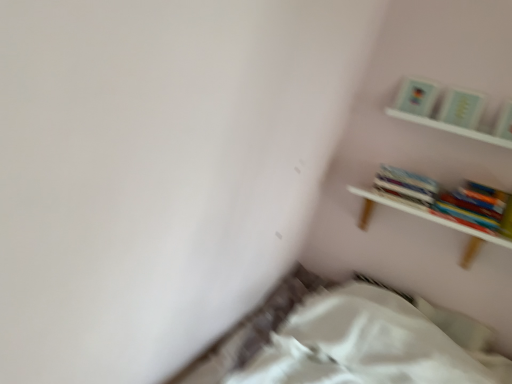
What do you see at coordinates (504, 122) in the screenshot? This screenshot has width=512, height=384. I see `hardcover book at upper right, the 1th paperback book from the right` at bounding box center [504, 122].

The width and height of the screenshot is (512, 384). I want to click on white wooden shelf at upper right, which is the first shelf from bottom to top, so click(431, 221).

The width and height of the screenshot is (512, 384). What do you see at coordinates (443, 110) in the screenshot?
I see `white wooden shelf at upper right, which is counted as the second shelf, starting from the bottom` at bounding box center [443, 110].

Locate an element on the screen. Image resolution: width=512 pixels, height=384 pixels. matte paper at upper right, the 2th paperback book when ordered from right to left is located at coordinates (461, 108).

Where is `hardcover book at upper right, the 1th paperback book from the right`? hardcover book at upper right, the 1th paperback book from the right is located at coordinates (504, 122).

Is matte paper at upper right, positioned as the 3th paperback book in right-to-left order, located within hardcover book at upper right, the 1th paperback book from the right?

Definitely not — matte paper at upper right, positioned as the 3th paperback book in right-to-left order, is not inside hardcover book at upper right, the 1th paperback book from the right.

Looking at this image, from a real-world perspective, is hardcover book at upper right, the 3th paperback book when ordered from left to right, over matte paper at upper right, positioned as the 3th paperback book in right-to-left order?

No, from a real-world perspective, hardcover book at upper right, the 3th paperback book when ordered from left to right, is not on top of matte paper at upper right, positioned as the 3th paperback book in right-to-left order.

Which of these two, hardcover book at upper right, the 1th paperback book from the right, or matte paper at upper right, acting as the first paperback book starting from the left, is wider?

With larger width is matte paper at upper right, acting as the first paperback book starting from the left.

Which is further, [499,117] or [399,102]?

The point [399,102] is behind.

From a real-world perspective, is hardcover book at upper right, the 3th paperback book when ordered from left to right, positioned under white fabric bed at lower center based on gravity?

No.

Is hardcover book at upper right, the 1th paperback book from the right, in front of white fabric bed at lower center?

No, the depth of hardcover book at upper right, the 1th paperback book from the right, is greater than that of white fabric bed at lower center.

Could you tell me if hardcover book at upper right, the 3th paperback book when ordered from left to right, is facing white fabric bed at lower center?

No, hardcover book at upper right, the 3th paperback book when ordered from left to right, is not facing towards white fabric bed at lower center.

Considering the points (502, 119) and (332, 338), which point is in front, point (502, 119) or point (332, 338)?

The point (332, 338) is in front.

How far apart are white fabric bed at lower center and matte paper at upper right, the 2th paperback book when ordered from right to left?

3.59 feet.

Is white fabric bed at lower center facing away from matte paper at upper right, which is the second paperback book from left to right?

No, white fabric bed at lower center is not facing away from matte paper at upper right, which is the second paperback book from left to right.

Considering the sizes of objects white fabric bed at lower center and matte paper at upper right, which is the second paperback book from left to right, in the image provided, who is thinner, white fabric bed at lower center or matte paper at upper right, which is the second paperback book from left to right,?

matte paper at upper right, which is the second paperback book from left to right, is thinner.

Looking at their sizes, would you say white wooden shelf at upper right, which is the first shelf from bottom to top, is wider or thinner than matte paper at upper right, positioned as the 3th paperback book in right-to-left order?

white wooden shelf at upper right, which is the first shelf from bottom to top, is wider than matte paper at upper right, positioned as the 3th paperback book in right-to-left order.

From the image's perspective, is white wooden shelf at upper right, which is the first shelf from bottom to top, above or below matte paper at upper right, positioned as the 3th paperback book in right-to-left order?

Based on their image positions, white wooden shelf at upper right, which is the first shelf from bottom to top, is located beneath matte paper at upper right, positioned as the 3th paperback book in right-to-left order.

Looking at the image, does white wooden shelf at upper right, the 2th shelf positioned from the top, seem bigger or smaller compared to matte paper at upper right, positioned as the 3th paperback book in right-to-left order?

Clearly, white wooden shelf at upper right, the 2th shelf positioned from the top, is larger in size than matte paper at upper right, positioned as the 3th paperback book in right-to-left order.

Would you say white wooden shelf at upper right, the 2th shelf positioned from the top, is to the left or to the right of matte paper at upper right, positioned as the 3th paperback book in right-to-left order, in the picture?

white wooden shelf at upper right, the 2th shelf positioned from the top, is positioned on matte paper at upper right, positioned as the 3th paperback book in right-to-left order,'s right side.

From a real-world perspective, is matte paper at upper right, acting as the first paperback book starting from the left, positioned above or below hardcover books at upper right?

matte paper at upper right, acting as the first paperback book starting from the left, is above hardcover books at upper right.

Considering the sizes of matte paper at upper right, positioned as the 3th paperback book in right-to-left order, and hardcover books at upper right in the image, is matte paper at upper right, positioned as the 3th paperback book in right-to-left order, bigger or smaller than hardcover books at upper right?

Considering their sizes, matte paper at upper right, positioned as the 3th paperback book in right-to-left order, takes up less space than hardcover books at upper right.

Is matte paper at upper right, positioned as the 3th paperback book in right-to-left order, next to hardcover books at upper right?

No, matte paper at upper right, positioned as the 3th paperback book in right-to-left order, is not making contact with hardcover books at upper right.

Considering the positions of objects matte paper at upper right, acting as the first paperback book starting from the left, and hardcover books at upper right in the image provided, who is more to the left, matte paper at upper right, acting as the first paperback book starting from the left, or hardcover books at upper right?

Positioned to the left is hardcover books at upper right.

Considering the sizes of objects hardcover books at upper right and white wooden shelf at upper right, the 1th shelf in the top-to-bottom sequence, in the image provided, who is smaller, hardcover books at upper right or white wooden shelf at upper right, the 1th shelf in the top-to-bottom sequence,?

Smaller between the two is white wooden shelf at upper right, the 1th shelf in the top-to-bottom sequence.

Starting from the hardcover books at upper right, which shelf is the 1st one in front? Please provide its 2D coordinates.

[(443, 110)]

Is white wooden shelf at upper right, which is counted as the second shelf, starting from the bottom, located within hardcover books at upper right?

No.

From the image's perspective, does hardcover books at upper right appear lower than white wooden shelf at upper right, the 1th shelf in the top-to-bottom sequence?

Yes, from the image's perspective, hardcover books at upper right is beneath white wooden shelf at upper right, the 1th shelf in the top-to-bottom sequence.

From the image's perspective, which is below, matte paper at upper right, which is the second paperback book from left to right, or white wooden shelf at upper right, the 1th shelf in the top-to-bottom sequence?

white wooden shelf at upper right, the 1th shelf in the top-to-bottom sequence, is shown below in the image.

Which is behind, point (461, 98) or point (420, 95)?

The point (420, 95) is farther from the camera.

Which object is wider, matte paper at upper right, the 2th paperback book when ordered from right to left, or white wooden shelf at upper right, which is counted as the second shelf, starting from the bottom?

white wooden shelf at upper right, which is counted as the second shelf, starting from the bottom, is wider.

Looking at this image, is matte paper at upper right, the 2th paperback book when ordered from right to left, not near white wooden shelf at upper right, the 1th shelf in the top-to-bottom sequence?

That's not correct — matte paper at upper right, the 2th paperback book when ordered from right to left, is a little close to white wooden shelf at upper right, the 1th shelf in the top-to-bottom sequence.

From the hardcover book at upper right, the 1th paperback book from the right, count 2nd paperback books backward and point to it. Please provide its 2D coordinates.

[(416, 96)]

There is a white fabric bed at lower center. Where is `the 2nd paperback book above it (from a real-world perspective)`? This screenshot has height=384, width=512. the 2nd paperback book above it (from a real-world perspective) is located at coordinates (504, 122).

Based on their spatial positions, is hardcover book at upper right, the 3th paperback book when ordered from left to right, or hardcover books at upper right closer to matte paper at upper right, which is the second paperback book from left to right?

Among the two, hardcover book at upper right, the 3th paperback book when ordered from left to right, is located nearer to matte paper at upper right, which is the second paperback book from left to right.

Considering their positions, is white fabric bed at lower center positioned further to matte paper at upper right, which is the second paperback book from left to right, than white wooden shelf at upper right, which is counted as the second shelf, starting from the bottom?

white fabric bed at lower center is positioned further to the anchor matte paper at upper right, which is the second paperback book from left to right.

Based on their spatial positions, is white wooden shelf at upper right, the 1th shelf in the top-to-bottom sequence, or hardcover book at upper right, the 1th paperback book from the right, further from matte paper at upper right, which is the second paperback book from left to right?

Among the two, hardcover book at upper right, the 1th paperback book from the right, is located further to matte paper at upper right, which is the second paperback book from left to right.

From the image, which object appears to be farther from white wooden shelf at upper right, the 2th shelf positioned from the top, matte paper at upper right, the 2th paperback book when ordered from right to left, or white fabric bed at lower center?

The object further to white wooden shelf at upper right, the 2th shelf positioned from the top, is white fabric bed at lower center.

Based on the photo, which object lies nearer to the anchor point hardcover book at upper right, the 3th paperback book when ordered from left to right, white wooden shelf at upper right, which is counted as the second shelf, starting from the bottom, or matte paper at upper right, acting as the first paperback book starting from the left?

white wooden shelf at upper right, which is counted as the second shelf, starting from the bottom, is positioned closer to the anchor hardcover book at upper right, the 3th paperback book when ordered from left to right.

Estimate the real-world distances between objects in this image. Which object is closer to hardcover book at upper right, the 3th paperback book when ordered from left to right, matte paper at upper right, acting as the first paperback book starting from the left, or white wooden shelf at upper right, which is the first shelf from bottom to top?

matte paper at upper right, acting as the first paperback book starting from the left, is closer to hardcover book at upper right, the 3th paperback book when ordered from left to right.

Which object lies nearer to the anchor point white wooden shelf at upper right, the 2th shelf positioned from the top, hardcover books at upper right or matte paper at upper right, positioned as the 3th paperback book in right-to-left order?

Among the two, hardcover books at upper right is located nearer to white wooden shelf at upper right, the 2th shelf positioned from the top.

Estimate the real-world distances between objects in this image. Which object is closer to hardcover books at upper right, white wooden shelf at upper right, the 1th shelf in the top-to-bottom sequence, or white fabric bed at lower center?

The object closer to hardcover books at upper right is white wooden shelf at upper right, the 1th shelf in the top-to-bottom sequence.

You are a GUI agent. You are given a task and a screenshot of the screen. Output one action in this format:
    pyautogui.click(x=<x>, y=<y>)
    Task: Click on the book between white fabric bed at lower center and matte paper at upper right, acting as the first paperback book starting from the left, from front to back
    Image resolution: width=512 pixels, height=384 pixels.
    Given the screenshot: What is the action you would take?
    pyautogui.click(x=406, y=184)

The width and height of the screenshot is (512, 384). Find the location of `shelf between matte paper at upper right, positioned as the 3th paperback book in right-to-left order, and hardcover books at upper right, in the vertical direction`. shelf between matte paper at upper right, positioned as the 3th paperback book in right-to-left order, and hardcover books at upper right, in the vertical direction is located at coordinates (443, 110).

Image resolution: width=512 pixels, height=384 pixels. What are the coordinates of `shelf between matte paper at upper right, which is the second paperback book from left to right, and white wooden shelf at upper right, which is the first shelf from bottom to top, from top to bottom` in the screenshot? It's located at (443, 110).

This screenshot has width=512, height=384. Find the location of `book between white fabric bed at lower center and matte paper at upper right, which is the second paperback book from left to right, from front to back`. book between white fabric bed at lower center and matte paper at upper right, which is the second paperback book from left to right, from front to back is located at coordinates (406, 184).